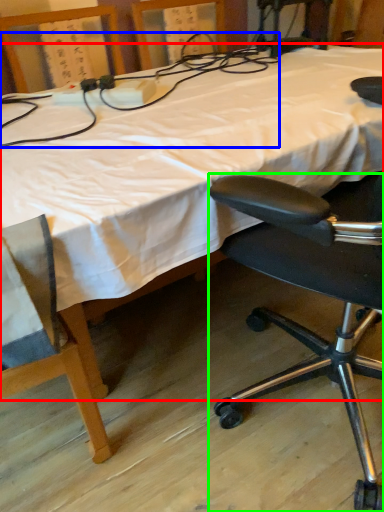
Question: Which is nearer to the bed (highlighted by a red box)? twin (highlighted by a blue box) or chair (highlighted by a green box).

Choices:
 (A) twin
 (B) chair

Answer: (A)